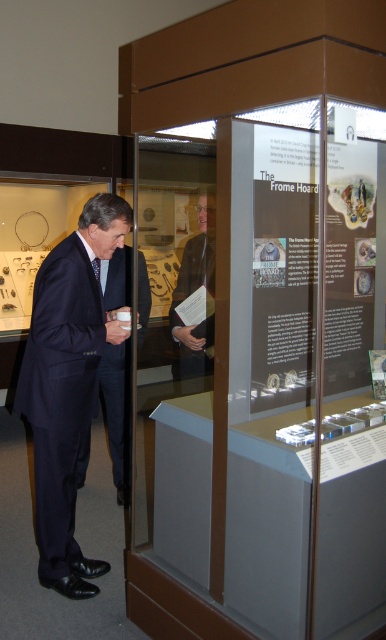
You are a security guard in the museum and need to ensure that both visitors are within the restricted area marked by a 1.8 meters height barrier. Given the information, can both the navy blue suit at left and the matte brown jacket at center pass under the barrier without bending?

The navy blue suit at left has a greater height compared to the matte brown jacket at center. If the navy blue suit at left is taller than 1.8 meters, they would not be able to pass under the barrier without bending. However, since the exact height is not provided, we cannot definitively determine if both can pass. The answer requires knowing their actual heights.

You are a security guard in the museum and need to locate a specific point marked on the map. The point is at coordinates point (76, 380). According to the scene description, where is this point located?

The point (76, 380) is located on the navy blue suit at left.